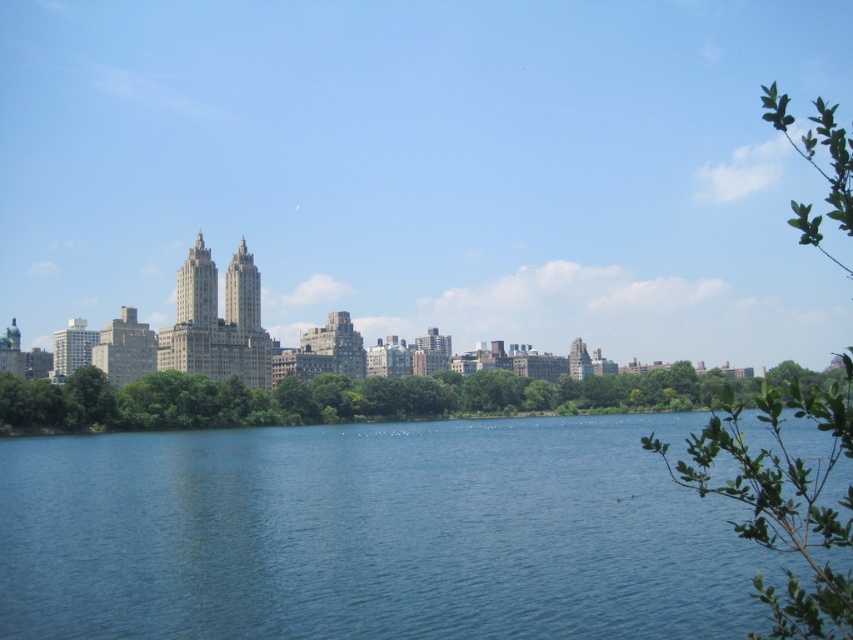
You are an architect designing a new observation deck that needs to have a clear view of both the blue water at center and the green leafy trees at center. Based on the scene, which object will appear closer to the deck when viewed from the deck?

The blue water at center will appear closer to the deck than the green leafy trees at center because the blue water at center is much taller as green leafy trees at center.

You are a bird flying towards the green leafy trees at center and the green leafy branch at upper right. Which one will you reach first?

The green leafy trees at center will be reached first because they are closer to the viewer compared to the green leafy branch at upper right.

You are an architect designing a new park and want to incorporate elements from this scene. If you need to place a pathway that must be wider than the green leafy branch at upper right, can the blue water at center serve as a reference for the pathway width?

The blue water at center is wider than the green leafy branch at upper right. Therefore, using the blue water at center as a reference for the pathway width would ensure it meets the requirement of being wider than the green leafy branch at upper right.